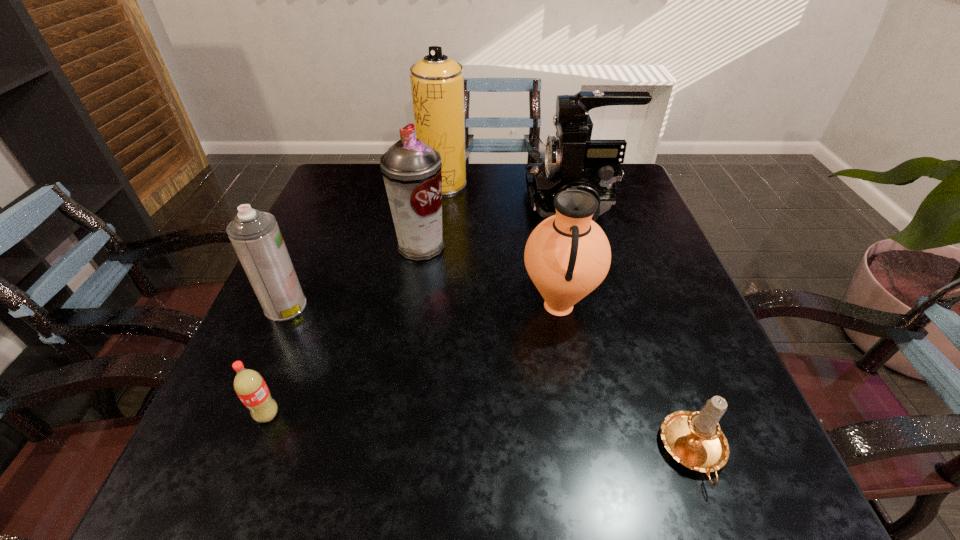
In the image, there is a desktop. Where is `free space at the right edge`? free space at the right edge is located at coordinates (665, 260).

Where is `vacant area at the far left corner of the desktop`? The image size is (960, 540). vacant area at the far left corner of the desktop is located at coordinates (334, 194).

This screenshot has width=960, height=540. Identify the location of blank region between the camcorder and the second farthest aerosol can. (497, 226).

You are a GUI agent. You are given a task and a screenshot of the screen. Output one action in this format:
    pyautogui.click(x=<x>, y=<y>)
    Task: Click on the free space between the nearest aerosol can and the soda
    This screenshot has width=960, height=540.
    Given the screenshot: What is the action you would take?
    pyautogui.click(x=276, y=361)

At what (x,y) coordinates should I click in order to perform the action: click on unoccupied area between the camcorder and the soda. Please return your answer as a coordinate pair (x, y). This screenshot has width=960, height=540. Looking at the image, I should click on (420, 310).

The width and height of the screenshot is (960, 540). What are the coordinates of `free space between the candle and the nearest aerosol can` in the screenshot? It's located at (490, 379).

Locate an element on the screen. This screenshot has height=540, width=960. free point between the camcorder and the second shortest aerosol can is located at coordinates (497, 226).

I want to click on free space between the leftmost aerosol can and the candle, so click(x=490, y=379).

Locate which object is the second closest to the nearest aerosol can. Please provide its 2D coordinates. Your answer should be formatted as a tuple, i.e. [(x, y)], where the tuple contains the x and y coordinates of a point satisfying the conditions above.

[(249, 385)]

Choose which object is the third nearest neighbor to the camcorder. Please provide its 2D coordinates. Your answer should be formatted as a tuple, i.e. [(x, y)], where the tuple contains the x and y coordinates of a point satisfying the conditions above.

[(411, 169)]